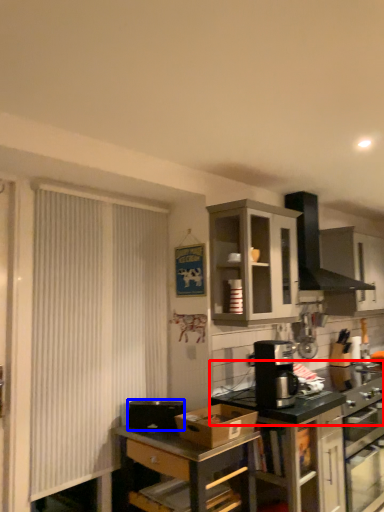
Question: Which of the following is the closest to the observer, countertop (highlighted by a red box) or appliance (highlighted by a blue box)?

Choices:
 (A) countertop
 (B) appliance

Answer: (B)